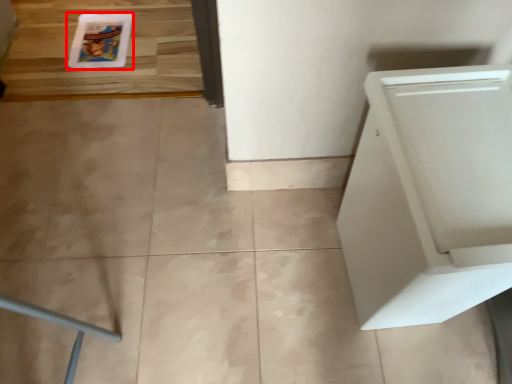
Question: From the image's perspective, where is comic book (annotated by the red box) located relative to home appliance?

Choices:
 (A) below
 (B) above

Answer: (B)